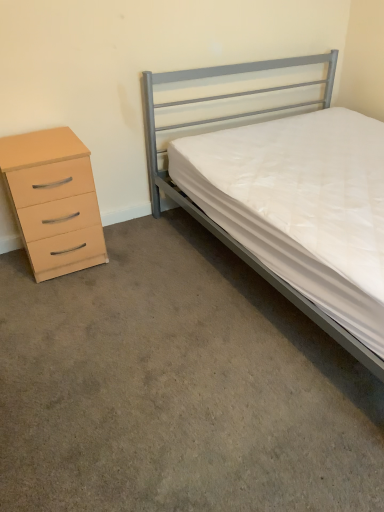
Locate an element on the screen. The image size is (384, 512). vacant area on top of beige matte chest of drawers at left (from a real-world perspective) is located at coordinates (34, 139).